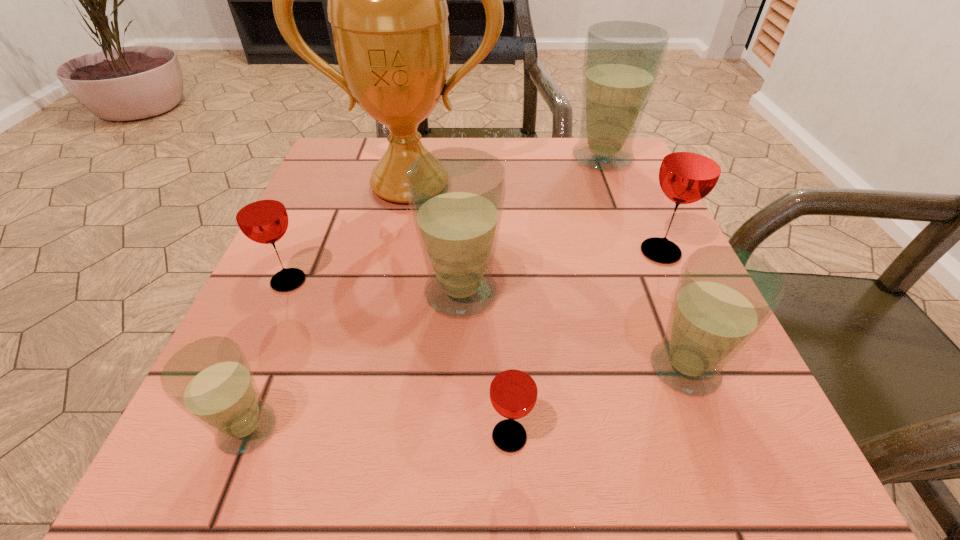
At what (x,y) coordinates should I click in order to perform the action: click on the smallest red glass. Please return your answer as a coordinate pair (x, y). This screenshot has height=540, width=960. Looking at the image, I should click on (513, 392).

Find the location of a particular element. This screenshot has width=960, height=540. vacant space located on the front of the award with the decoration is located at coordinates (374, 357).

The width and height of the screenshot is (960, 540). Find the location of `vacant space situated on the front of the biggest blue glass`. vacant space situated on the front of the biggest blue glass is located at coordinates (658, 298).

The image size is (960, 540). I want to click on vacant area situated 0.300m on the left of the rightmost red glass, so click(468, 252).

Identify the location of vacant space located 0.320m on the right of the third nearest blue glass. (699, 293).

This screenshot has height=540, width=960. Find the location of `vacant space located 0.060m on the back of the leftmost red glass`. vacant space located 0.060m on the back of the leftmost red glass is located at coordinates (304, 245).

Where is `free space located 0.300m on the left of the third biggest blue glass`? The width and height of the screenshot is (960, 540). free space located 0.300m on the left of the third biggest blue glass is located at coordinates (430, 368).

Where is `free spot located 0.120m on the right of the smallest blue glass`? The height and width of the screenshot is (540, 960). free spot located 0.120m on the right of the smallest blue glass is located at coordinates click(x=376, y=429).

The height and width of the screenshot is (540, 960). Identify the location of vacant space situated on the left of the smallest red glass. (366, 436).

The height and width of the screenshot is (540, 960). What are the coordinates of `award located in the far edge section of the desktop` in the screenshot? It's located at (386, 0).